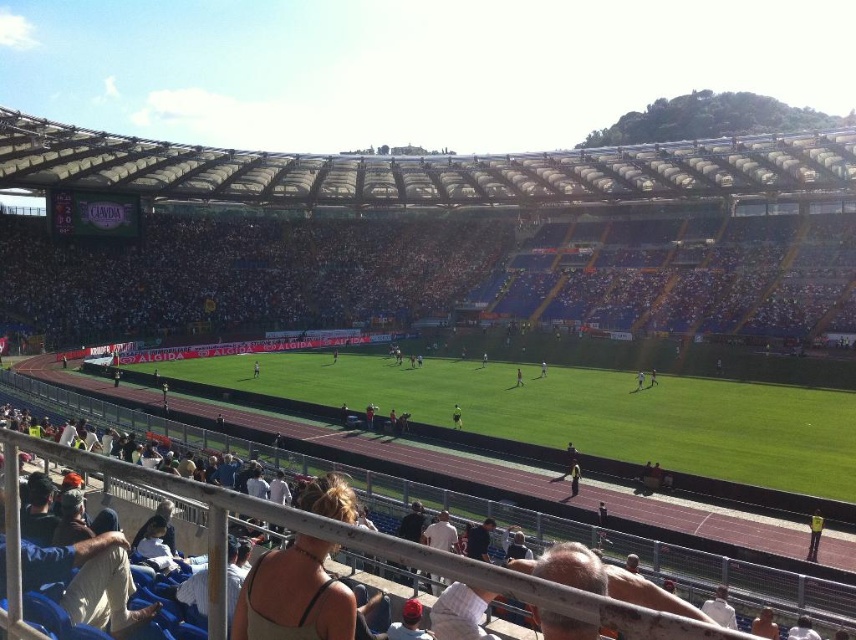
You are a spectator at the stadium and want to find the best spot to watch the soccer match. You have two options in the image provided. The first option is to sit on the dark blue seats at center, and the second is to stand on the dark gray track at lower center. Which location offers a higher vantage point for viewing the game?

The dark blue seats at center are located above the dark gray track at lower center, so sitting on the dark blue seats at center would provide a higher vantage point for watching the soccer match.

You are a photographer trying to capture a photo of the soccer match. You notice the green grass at center and the light blue jersey at center in your viewfinder. Which object appears smaller in the photo?

The green grass at center appears smaller in the photo because it has a smaller size compared to the light blue jersey at center.